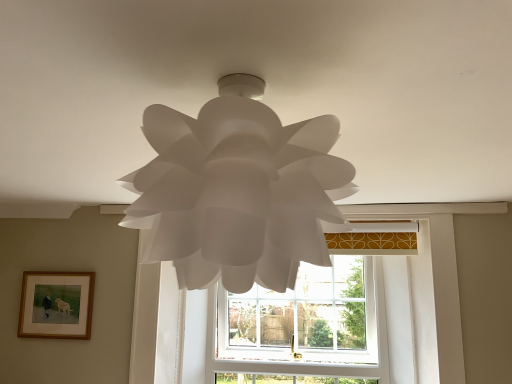
Where is `white plastic window at center`? white plastic window at center is located at coordinates (302, 315).

Is wooden framed picture at lower left shorter than white paper lamp at center?

Yes, wooden framed picture at lower left is shorter than white paper lamp at center.

From a real-world perspective, is wooden framed picture at lower left below white paper lamp at center?

Yes, from a real-world perspective, wooden framed picture at lower left is below white paper lamp at center.

Based on the photo, does wooden framed picture at lower left have a greater width compared to white paper lamp at center?

In fact, wooden framed picture at lower left might be narrower than white paper lamp at center.

Is wooden framed picture at lower left inside or outside of white plastic window at center?

wooden framed picture at lower left is spatially situated outside white plastic window at center.

Who is more distant, wooden framed picture at lower left or white plastic window at center?

white plastic window at center.

From the picture: Is wooden framed picture at lower left smaller than white plastic window at center?

Correct, wooden framed picture at lower left occupies less space than white plastic window at center.

Considering the relative sizes of white paper lamp at center and white plastic window at center in the image provided, is white paper lamp at center thinner than white plastic window at center?

No, white paper lamp at center is not thinner than white plastic window at center.

Would you consider white paper lamp at center to be distant from white plastic window at center?

Yes.

Would you say white paper lamp at center is inside or outside white plastic window at center?

The correct answer is: outside.

From the image's perspective, relative to white paper lamp at center, is white plastic window at center above or below?

Based on their image positions, white plastic window at center is located beneath white paper lamp at center.

Which is farther from the camera, (237,335) or (165,225)?

The point (237,335) is more distant.

Locate an element on the screen. lamp on the left of white plastic window at center is located at coordinates (237, 190).

Relative to white paper lamp at center, is white plastic window at center in front or behind?

In the image, white plastic window at center appears behind white paper lamp at center.

How far apart are white plastic window at center and wooden framed picture at lower left?

white plastic window at center is 1.00 meters away from wooden framed picture at lower left.

From a real-world perspective, is white plastic window at center positioned above or below wooden framed picture at lower left?

white plastic window at center is situated lower than wooden framed picture at lower left in the real world.

Who is taller, white plastic window at center or wooden framed picture at lower left?

With more height is white plastic window at center.

Are white plastic window at center and wooden framed picture at lower left far apart?

That's right, there is a large distance between white plastic window at center and wooden framed picture at lower left.

Would you say white paper lamp at center is to the left or to the right of wooden framed picture at lower left in the picture?

white paper lamp at center is positioned on wooden framed picture at lower left's right side.

Considering the relative sizes of white paper lamp at center and wooden framed picture at lower left in the image provided, is white paper lamp at center smaller than wooden framed picture at lower left?

No.

From the image's perspective, is white paper lamp at center positioned above or below wooden framed picture at lower left?

Clearly, from the image's perspective, white paper lamp at center is above wooden framed picture at lower left.

Does white paper lamp at center turn towards wooden framed picture at lower left?

No.

I want to click on picture frame behind the white paper lamp at center, so click(56, 305).

At what (x,y) coordinates should I click in order to perform the action: click on picture frame located above the white plastic window at center (from a real-world perspective). Please return your answer as a coordinate pair (x, y). Looking at the image, I should click on (56, 305).

From the image, which object appears to be farther from white plastic window at center, white paper lamp at center or wooden framed picture at lower left?

white paper lamp at center.

Based on their spatial positions, is white plastic window at center or wooden framed picture at lower left further from white paper lamp at center?

Based on the image, white plastic window at center appears to be further to white paper lamp at center.

From the image, which object appears to be farther from white plastic window at center, wooden framed picture at lower left or white paper lamp at center?

white paper lamp at center lies further to white plastic window at center than the other object.

From the image, which object appears to be farther from wooden framed picture at lower left, white plastic window at center or white paper lamp at center?

Based on the image, white paper lamp at center appears to be further to wooden framed picture at lower left.

Based on their spatial positions, is white paper lamp at center or white plastic window at center further from wooden framed picture at lower left?

The object further to wooden framed picture at lower left is white paper lamp at center.

Looking at the image, which one is located further to white paper lamp at center, wooden framed picture at lower left or white plastic window at center?

Among the two, white plastic window at center is located further to white paper lamp at center.

This screenshot has height=384, width=512. What are the coordinates of `picture frame between white paper lamp at center and white plastic window at center in the front-back direction` in the screenshot? It's located at [56, 305].